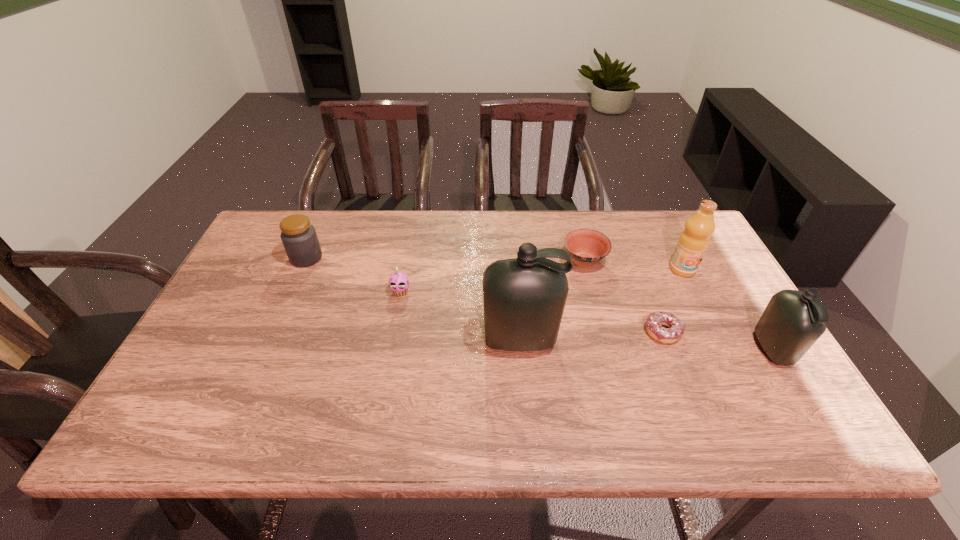
The image size is (960, 540). I want to click on vacant space in between the shortest object and the shorter bottle, so click(x=718, y=341).

The image size is (960, 540). Identify the location of free space between the third object from right to left and the left bottle. [x=591, y=336].

Select which object is the fifth closest to the fourth tallest object. Please provide its 2D coordinates. Your answer should be formatted as a tuple, i.e. [(x, y)], where the tuple contains the x and y coordinates of a point satisfying the conditions above.

[(694, 240)]

I want to click on object that ranks as the closest to the third object from left to right, so click(x=586, y=247).

At what (x,y) coordinates should I click in order to perform the action: click on vacant area in the image that satisfies the following two spatial constraints: 1. on the face of the fifth tallest object; 2. on the right side of the shorter bottle. Please return your answer as a coordinate pair (x, y). This screenshot has height=540, width=960. Looking at the image, I should click on (390, 349).

The width and height of the screenshot is (960, 540). In order to click on free space that satisfies the following two spatial constraints: 1. on the surface of the jar near the warning symbol; 2. on the right side of the shortest object in this screenshot , I will do `click(274, 332)`.

Identify the location of vacant space that satisfies the following two spatial constraints: 1. on the front label of the second object from right to left; 2. on the right side of the shorter bottle. (723, 349).

Locate an element on the screen. free space that satisfies the following two spatial constraints: 1. on the surface of the jar near the warning symbol; 2. on the back side of the taller bottle is located at coordinates (270, 340).